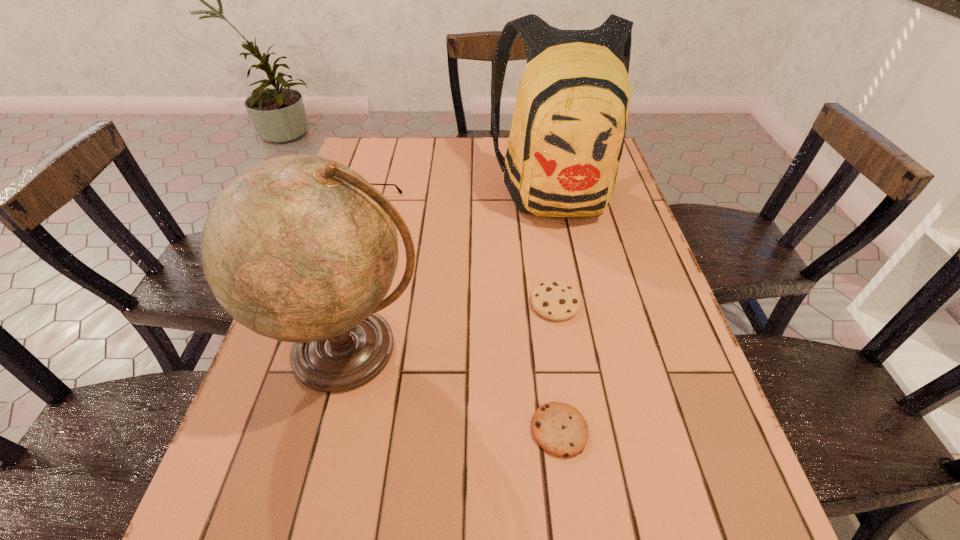
Where is `backpack`? backpack is located at coordinates (567, 134).

Where is `globe`? The height and width of the screenshot is (540, 960). globe is located at coordinates (299, 248).

Find the location of a particular element. the third shortest object is located at coordinates (399, 190).

Find the location of a particular element. The width and height of the screenshot is (960, 540). the taller cookie is located at coordinates (554, 300).

The image size is (960, 540). What are the coordinates of `the fourth tallest object` in the screenshot? It's located at (554, 300).

Where is `the shorter cookie`? This screenshot has height=540, width=960. the shorter cookie is located at coordinates (560, 429).

The width and height of the screenshot is (960, 540). What are the coordinates of `the shortest object` in the screenshot? It's located at (560, 429).

Locate an element on the screen. blank space located 0.190m on the front-facing side of the backpack is located at coordinates (577, 286).

Image resolution: width=960 pixels, height=540 pixels. Find the location of `vacant position located 0.180m on the front-facing side of the globe`. vacant position located 0.180m on the front-facing side of the globe is located at coordinates (304, 525).

The width and height of the screenshot is (960, 540). Identify the location of vacant space positioned on the front of the second shortest object. (575, 427).